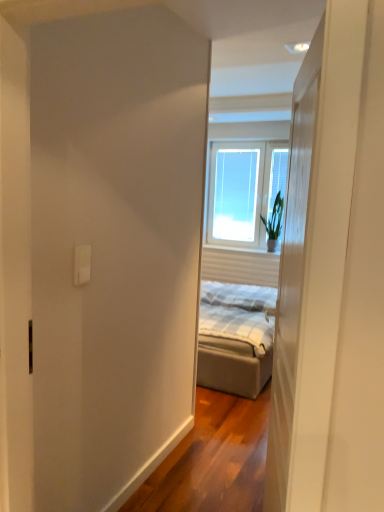
Question: In terms of width, does transparent glass window at center, which is the first window in left-to-right order, look wider or thinner when compared to clear glass window at center, the 1th window in the right-to-left sequence?

Choices:
 (A) thin
 (B) wide

Answer: (A)

Question: Would you say transparent glass window at center, which is the first window in left-to-right order, is inside or outside clear glass window at center, the 1th window in the right-to-left sequence?

Choices:
 (A) inside
 (B) outside

Answer: (A)

Question: Estimate the real-world distances between objects in this image. Which object is farther from the green leafy plant at window?

Choices:
 (A) transparent glass window at center, which is the first window in left-to-right order
 (B) clear glass window at center, the 1th window in the right-to-left sequence
 (C) white plastic outlet at upper left
 (D) white wood door at center

Answer: (C)

Question: Estimate the real-world distances between objects in this image. Which object is farther from the white wood door at center?

Choices:
 (A) green leafy plant at window
 (B) clear glass window at center, the 1th window in the right-to-left sequence
 (C) white plastic outlet at upper left
 (D) transparent glass window at center, the second window viewed from the right

Answer: (D)